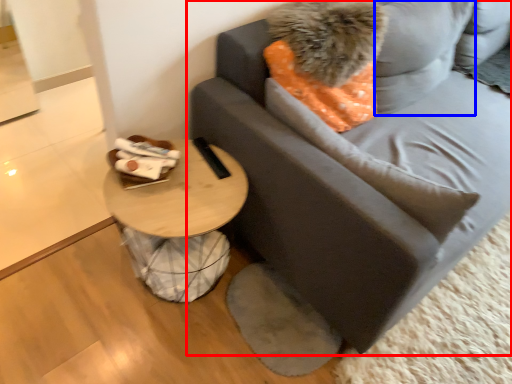
Question: Which point is further to the camera, studio couch (highlighted by a red box) or pillow (highlighted by a blue box)?

Choices:
 (A) studio couch
 (B) pillow

Answer: (B)